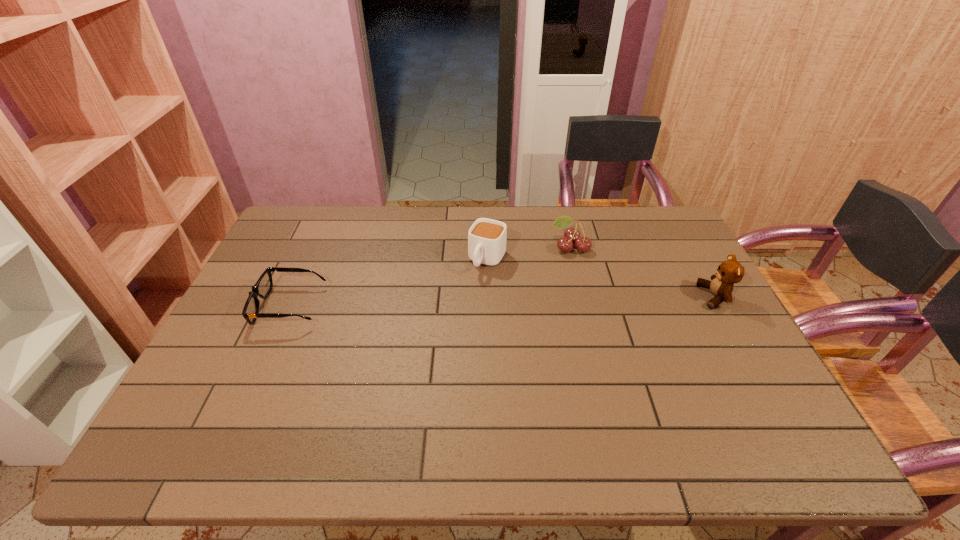
Find the location of `free space that is in between the third object from right to left and the teddy bear`. free space that is in between the third object from right to left and the teddy bear is located at coordinates (601, 278).

Locate an element on the screen. empty space that is in between the rightmost object and the cup is located at coordinates (601, 278).

Where is `empty space between the third object from left to right and the leftmost object`? empty space between the third object from left to right and the leftmost object is located at coordinates (430, 276).

Identify the location of vacant space in between the cherry and the shortest object. The height and width of the screenshot is (540, 960). (430, 276).

This screenshot has height=540, width=960. Identify the location of vacant point located between the shortest object and the tallest object. (502, 301).

I want to click on the third closest object to the third object from right to left, so click(x=730, y=271).

Identify the location of the third closest object to the tallest object. The height and width of the screenshot is (540, 960). (262, 288).

Where is `blank area in the image that satisfies the following two spatial constraints: 1. on the front side of the rightmost object; 2. on the front-facing side of the cherry`? The width and height of the screenshot is (960, 540). blank area in the image that satisfies the following two spatial constraints: 1. on the front side of the rightmost object; 2. on the front-facing side of the cherry is located at coordinates (583, 296).

Locate an element on the screen. The width and height of the screenshot is (960, 540). vacant region that satisfies the following two spatial constraints: 1. on the front side of the tallest object; 2. on the front-facing side of the cup is located at coordinates (488, 296).

This screenshot has height=540, width=960. I want to click on vacant space that satisfies the following two spatial constraints: 1. on the front side of the third object from left to right; 2. on the front-facing side of the rightmost object, so click(583, 296).